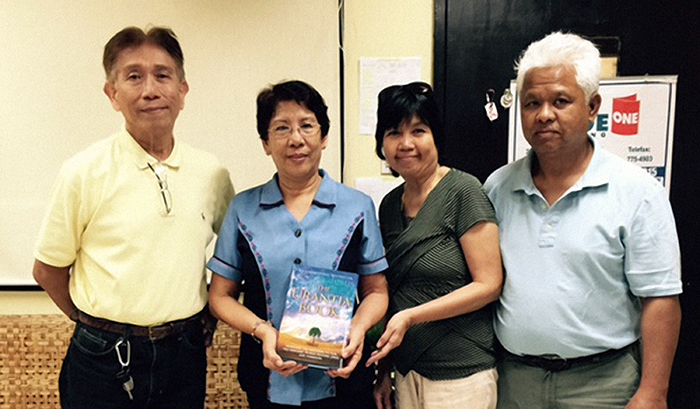
This screenshot has height=409, width=700. I want to click on book, so click(307, 320).